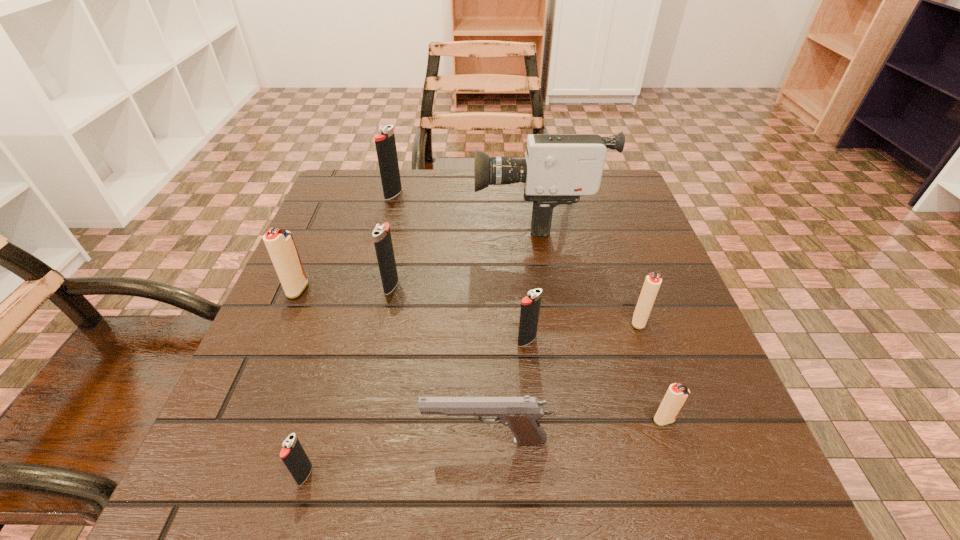
The image size is (960, 540). I want to click on the fourth nearest igniter, so click(652, 282).

Find the location of a particular element. Image resolution: width=960 pixels, height=540 pixels. the fifth nearest object is located at coordinates coord(652,282).

Find the location of a particular element. Image resolution: width=960 pixels, height=540 pixels. pistol is located at coordinates (520, 414).

At what (x,y) coordinates should I click in order to perform the action: click on the smallest red igniter. Please return your answer as a coordinate pair (x, y). The height and width of the screenshot is (540, 960). Looking at the image, I should click on (676, 395).

Locate an element on the screen. The height and width of the screenshot is (540, 960). the sixth farthest igniter is located at coordinates (676, 395).

I want to click on the smallest black igniter, so click(x=293, y=455).

This screenshot has height=540, width=960. What are the coordinates of `the nearest object` in the screenshot? It's located at (293, 455).

I want to click on free space located 0.090m on the recording direction of the white camcorder, so click(438, 215).

Where is `free space located 0.300m on the recording direction of the white camcorder`? This screenshot has width=960, height=540. free space located 0.300m on the recording direction of the white camcorder is located at coordinates (349, 215).

At what (x,y) coordinates should I click in order to perform the action: click on free spot located 0.090m on the recording direction of the white camcorder. Please return your answer as a coordinate pair (x, y). This screenshot has height=540, width=960. Looking at the image, I should click on (438, 215).